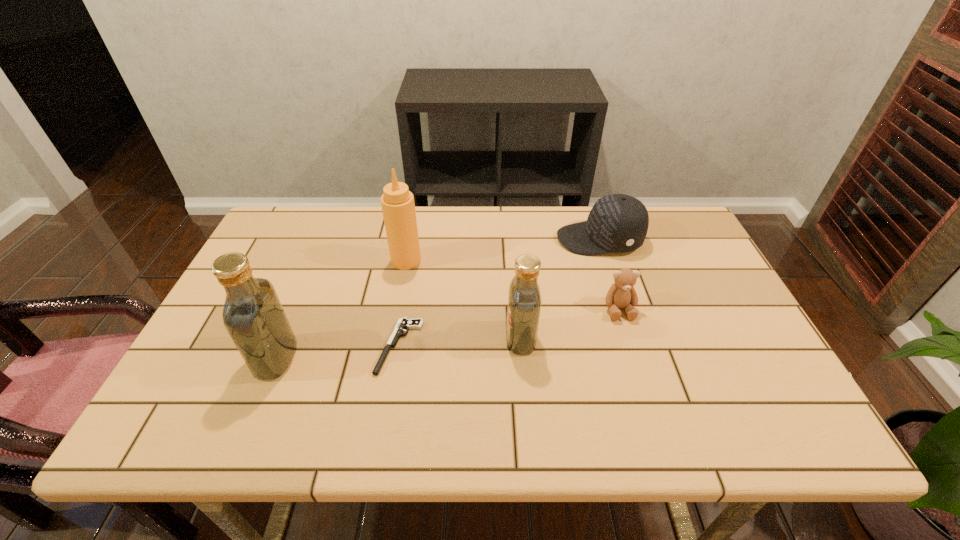
Locate an element on the screen. This screenshot has width=960, height=540. object that is the nearest to the shortest object is located at coordinates (398, 207).

This screenshot has width=960, height=540. Identify the location of free point that satisfies the following two spatial constraints: 1. on the face of the teddy bear; 2. on the front-facing side of the taller vodka. (635, 358).

Locate an element on the screen. The width and height of the screenshot is (960, 540). free space that satisfies the following two spatial constraints: 1. on the face of the fifth tallest object; 2. on the front-facing side of the shortest object is located at coordinates click(631, 346).

Find the location of `blank space that satisfies the following two spatial constraints: 1. on the face of the teddy bear; 2. on the front-facing side of the pistol`. blank space that satisfies the following two spatial constraints: 1. on the face of the teddy bear; 2. on the front-facing side of the pistol is located at coordinates (631, 346).